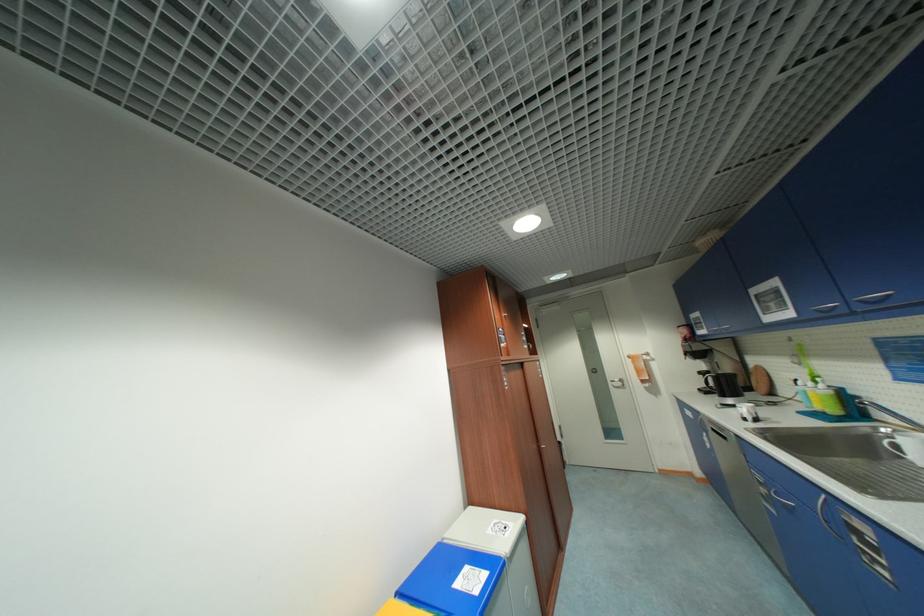
The width and height of the screenshot is (924, 616). Find the location of `silver door handle`. silver door handle is located at coordinates (617, 383).